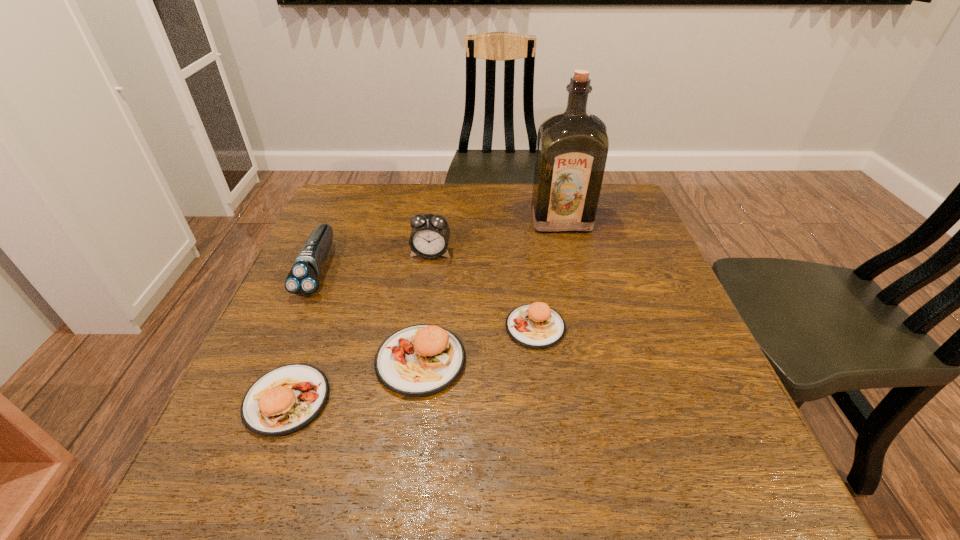
This screenshot has height=540, width=960. Identify the location of the leftmost patty. (286, 399).

Where is `the second patty from left to right`? The width and height of the screenshot is (960, 540). the second patty from left to right is located at coordinates (419, 360).

Where is `the rightmost patty`? the rightmost patty is located at coordinates (536, 325).

Find the location of a particular element. The width and height of the screenshot is (960, 540). the shortest patty is located at coordinates (536, 325).

Identify the location of electric shaver. (303, 279).

Where is `the fifth shortest object`? The height and width of the screenshot is (540, 960). the fifth shortest object is located at coordinates (429, 238).

What are the coordinates of `the tallest object` in the screenshot? It's located at (572, 147).

Image resolution: width=960 pixels, height=540 pixels. I want to click on liquor, so click(572, 147).

Where is `vacant space positioned on the back of the leftmost patty`? This screenshot has width=960, height=540. vacant space positioned on the back of the leftmost patty is located at coordinates (315, 327).

Where is `free point located on the back of the second patty from left to right`? Image resolution: width=960 pixels, height=540 pixels. free point located on the back of the second patty from left to right is located at coordinates (439, 220).